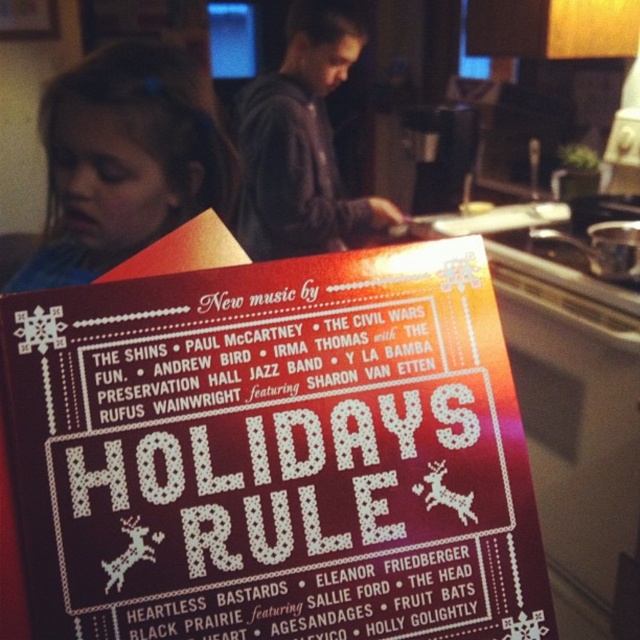
You are organizing a holiday gift wrap station and need to place the dark gray hoodie at center and the metallic silver pot at upper right on a shelf. Based on their positions in the image, which item should you place first to maintain the same spatial arrangement?

You should place the dark gray hoodie at center first because it is to the left of the metallic silver pot at upper right in the image, so placing it first ensures the correct left position.

You are organizing a holiday gift fair and have a display stand. You have a matte paper poster at center and a metallic silver pot at upper right. Which item takes up more space on the display stand?

The matte paper poster at center has a larger size compared to the metallic silver pot at upper right, so it takes up more space on the display stand.

You are an interior designer arranging items on a shelf. You have the matte paper poster at center and the metallic silver pot at upper right. Which object should you place on the left side of the shelf to ensure it doesn???t block the view of the other item?

You should place the metallic silver pot at upper right on the left side of the shelf because it is smaller in width than the matte paper poster at center, allowing the poster to be seen clearly without obstruction.